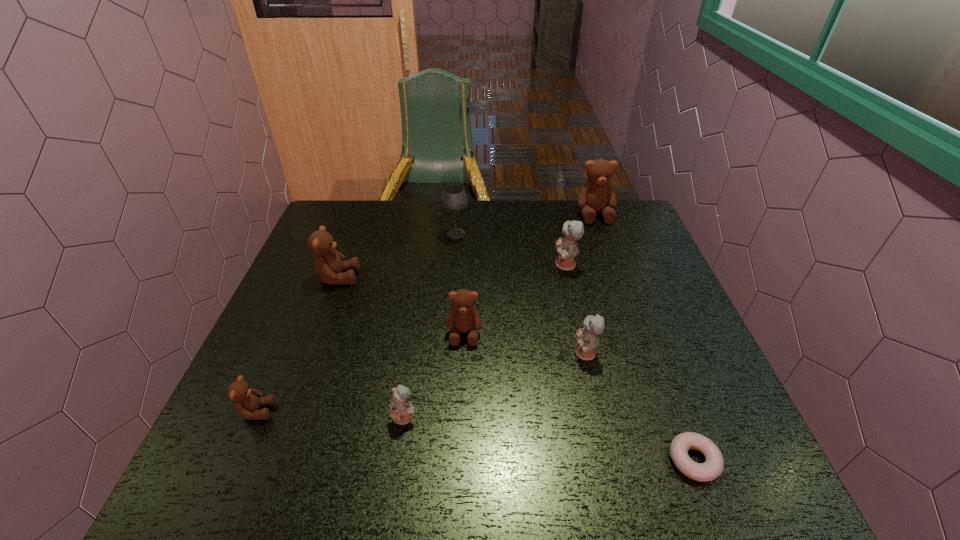
Where is `free space located on the front-facing side of the second nearest blue teddy bear`? free space located on the front-facing side of the second nearest blue teddy bear is located at coordinates (408, 354).

I want to click on vacant space located 0.310m on the front-facing side of the second nearest blue teddy bear, so click(x=439, y=354).

Where is `vacant area situated 0.230m on the front-facing side of the second nearest blue teddy bear`? The image size is (960, 540). vacant area situated 0.230m on the front-facing side of the second nearest blue teddy bear is located at coordinates (473, 354).

I want to click on free spot located on the face of the third brown teddy bear from left to right, so click(x=460, y=464).

The image size is (960, 540). I want to click on blank space located on the face of the nearest brown teddy bear, so click(x=444, y=411).

Locate an element on the screen. Image resolution: width=960 pixels, height=540 pixels. vacant area located on the left of the doughnut is located at coordinates (470, 461).

Image resolution: width=960 pixels, height=540 pixels. I want to click on teddy bear present at the far edge, so click(597, 194).

Find the location of a particular element. This screenshot has height=540, width=960. wineglass that is at the far edge is located at coordinates (454, 199).

What are the coordinates of `object that is at the near edge` in the screenshot? It's located at (713, 466).

Locate an element on the screen. The image size is (960, 540). teddy bear that is positioned at the right edge is located at coordinates (597, 194).